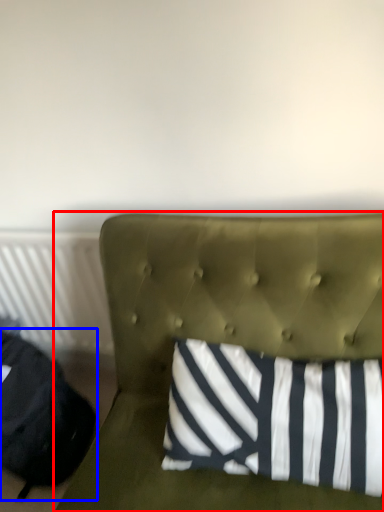
Question: Which object appears farthest to the camera in this image, furniture (highlighted by a red box) or bean bag chair (highlighted by a blue box)?

Choices:
 (A) furniture
 (B) bean bag chair

Answer: (B)